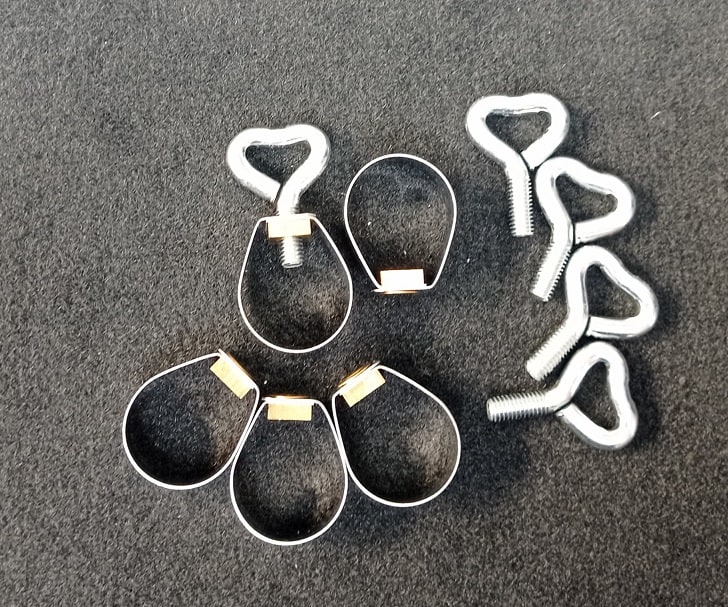
Find the location of a particular element. The image size is (728, 607). gray carpet is located at coordinates (100, 229), (625, 520), (638, 47), (138, 538), (434, 73).